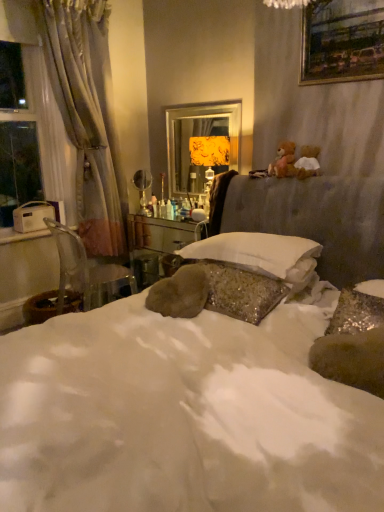
Question: Is clear plastic chair at left inside gold-framed painting at upper right?

Choices:
 (A) no
 (B) yes

Answer: (A)

Question: Considering the relative sizes of gold-framed painting at upper right and clear plastic chair at left in the image provided, is gold-framed painting at upper right shorter than clear plastic chair at left?

Choices:
 (A) no
 (B) yes

Answer: (B)

Question: Is gold-framed painting at upper right taller than clear plastic chair at left?

Choices:
 (A) no
 (B) yes

Answer: (A)

Question: Would you say gold-framed painting at upper right is a long distance from clear plastic chair at left?

Choices:
 (A) yes
 (B) no

Answer: (A)

Question: Is gold-framed painting at upper right facing away from clear plastic chair at left?

Choices:
 (A) no
 (B) yes

Answer: (A)

Question: Does point (278, 270) appear closer or farther from the camera than point (172, 145)?

Choices:
 (A) farther
 (B) closer

Answer: (B)

Question: Would you say white soft pillow at center is to the left or to the right of metallic gold mirror at center in the picture?

Choices:
 (A) left
 (B) right

Answer: (B)

Question: Is white soft pillow at center inside the boundaries of metallic gold mirror at center, or outside?

Choices:
 (A) outside
 (B) inside

Answer: (A)

Question: From the image's perspective, relative to metallic gold mirror at center, is white soft pillow at center above or below?

Choices:
 (A) below
 (B) above

Answer: (A)

Question: Based on their positions, is metallic gold mirror at center located to the left or right of gold-framed painting at upper right?

Choices:
 (A) right
 (B) left

Answer: (B)

Question: Considering the positions of metallic gold mirror at center and gold-framed painting at upper right in the image, is metallic gold mirror at center wider or thinner than gold-framed painting at upper right?

Choices:
 (A) thin
 (B) wide

Answer: (A)

Question: In terms of height, does metallic gold mirror at center look taller or shorter compared to gold-framed painting at upper right?

Choices:
 (A) short
 (B) tall

Answer: (B)

Question: In terms of size, does metallic gold mirror at center appear bigger or smaller than gold-framed painting at upper right?

Choices:
 (A) small
 (B) big

Answer: (B)

Question: Relative to gold-framed painting at upper right, is wooden vanity at center in front or behind?

Choices:
 (A) behind
 (B) front

Answer: (A)

Question: Is point (157, 233) closer or farther from the camera than point (345, 8)?

Choices:
 (A) closer
 (B) farther

Answer: (B)